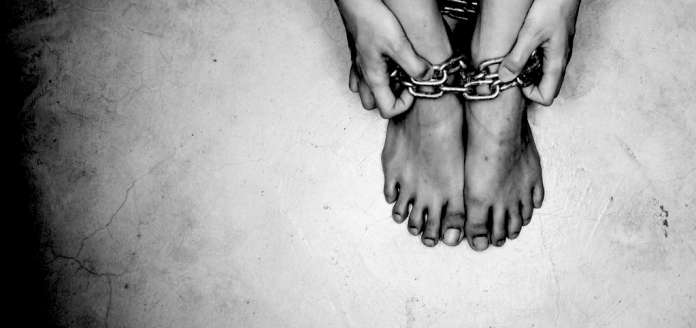
At what (x,y) coordinates should I click in order to perform the action: click on crack in concrete floor. Please return your answer as a coordinate pair (x, y). The image size is (696, 328). Looking at the image, I should click on (97, 271).